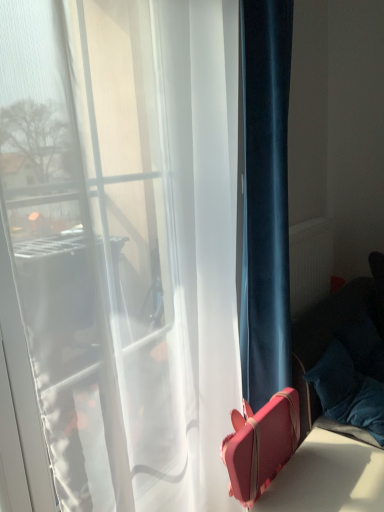
Find the location of a particular element. empty space that is ontop of pink leather suitcase at lower right (from a real-world perspective) is located at coordinates (334, 478).